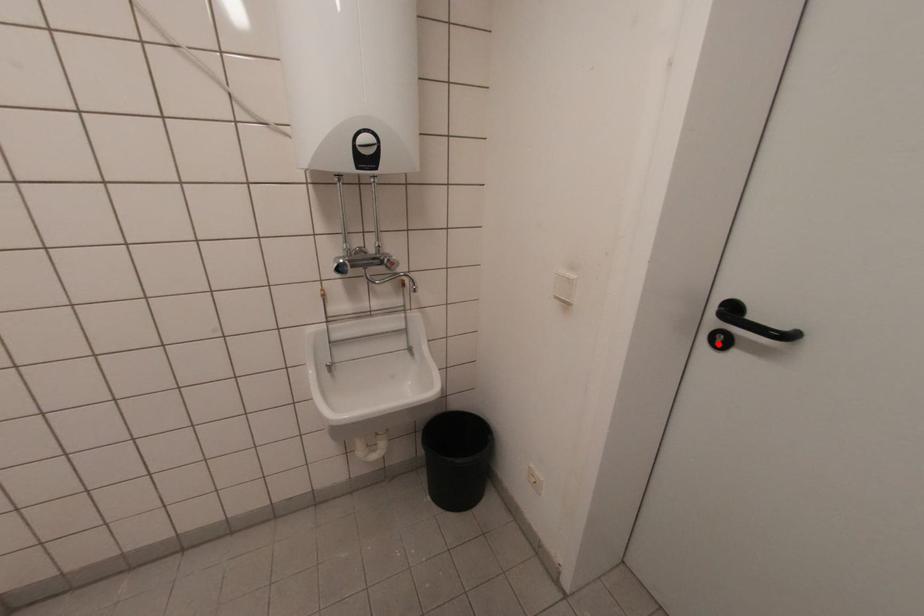
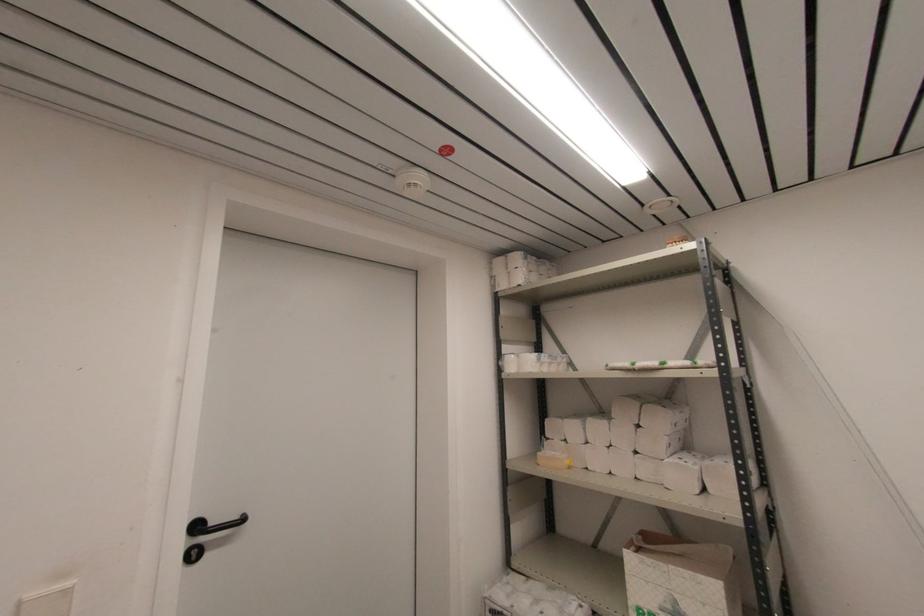
Find the pixel in the second image that matches the highlighted location in the first image.

(196, 557)